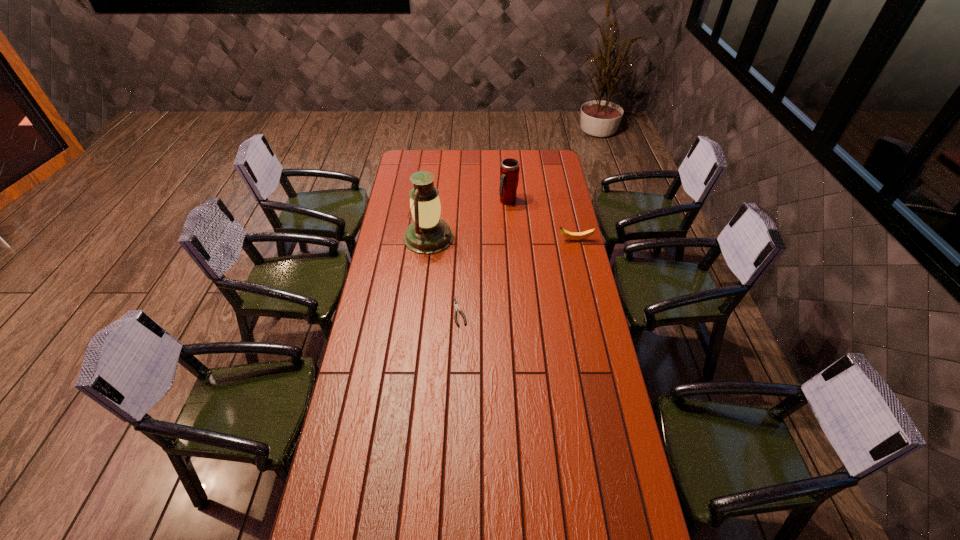
Where is `free space on the desktop that is between the nearest object and the rightmost object and is positioned on the side with the handle of the third shortest object`? free space on the desktop that is between the nearest object and the rightmost object and is positioned on the side with the handle of the third shortest object is located at coordinates (526, 271).

Locate an element on the screen. Image resolution: width=960 pixels, height=540 pixels. free space on the desktop that is between the shortest object and the banana and is positioned with the light compartment facing forward on the leftmost object is located at coordinates coord(537,264).